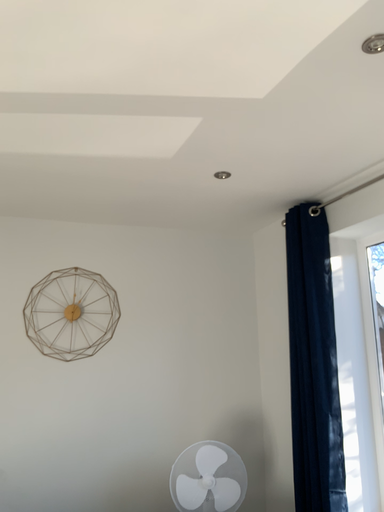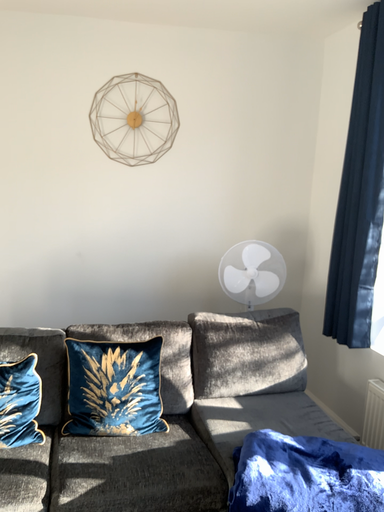
Question: Which way did the camera rotate in the video?

Choices:
 (A) rotated upward
 (B) rotated downward

Answer: (B)